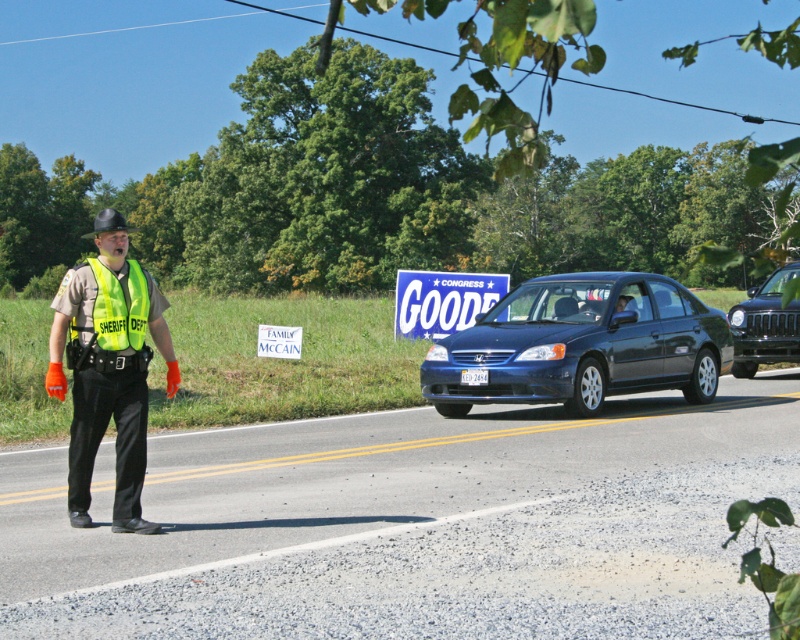
Question: Considering the real-world distances, which object is closest to the shiny black car at right?

Choices:
 (A) reflective yellow vest at left
 (B) asphalt road at center

Answer: (B)

Question: Which point is farther to the camera?

Choices:
 (A) (284, 355)
 (B) (633, 337)
 (C) (446, 310)
 (D) (100, 330)

Answer: (C)

Question: Does high-visibility reflective vest at left appear under shiny black car at right?

Choices:
 (A) yes
 (B) no

Answer: (A)

Question: Is the position of high-visibility reflective vest at left less distant than that of white paper sign at center?

Choices:
 (A) no
 (B) yes

Answer: (B)

Question: Can you confirm if high-visibility reflective vest at left is positioned above reflective yellow vest at left?

Choices:
 (A) yes
 (B) no

Answer: (B)

Question: Which of the following is the closest to the observer?

Choices:
 (A) shiny black car at right
 (B) asphalt road at center

Answer: (B)